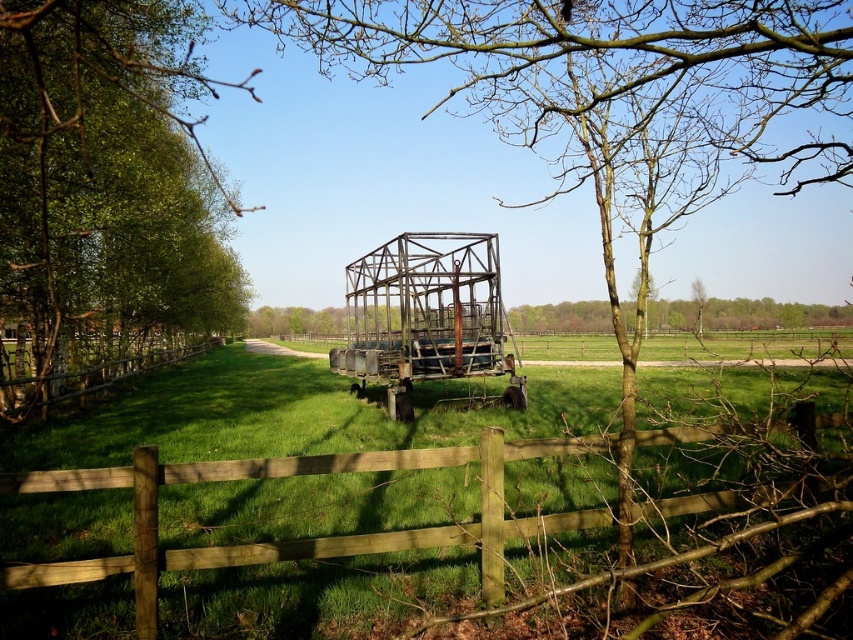
Is brown wooden fence at center bigger than brown wooden fence at left?

Incorrect, brown wooden fence at center is not larger than brown wooden fence at left.

From the picture: Who is more forward, (x=480, y=433) or (x=138, y=364)?

Point (x=480, y=433) is in front.

Where is `brown wooden fence at center`? The width and height of the screenshot is (853, 640). brown wooden fence at center is located at coordinates (299, 540).

Which is above, bare branches at center or brown wooden fence at center?

Positioned higher is bare branches at center.

Can you confirm if bare branches at center is positioned below brown wooden fence at center?

Actually, bare branches at center is above brown wooden fence at center.

Where is `bare branches at center`? bare branches at center is located at coordinates (602, 68).

Where is `bare branches at center`? bare branches at center is located at coordinates (602, 68).

Is point (128, 262) positioned in front of point (497, 28)?

No, (128, 262) is behind (497, 28).

Is green leafy tree at left below bare branches at center?

Indeed, green leafy tree at left is positioned under bare branches at center.

Does point (108, 74) come behind point (332, 60)?

That is False.

Identify the location of green leafy tree at left. (105, 196).